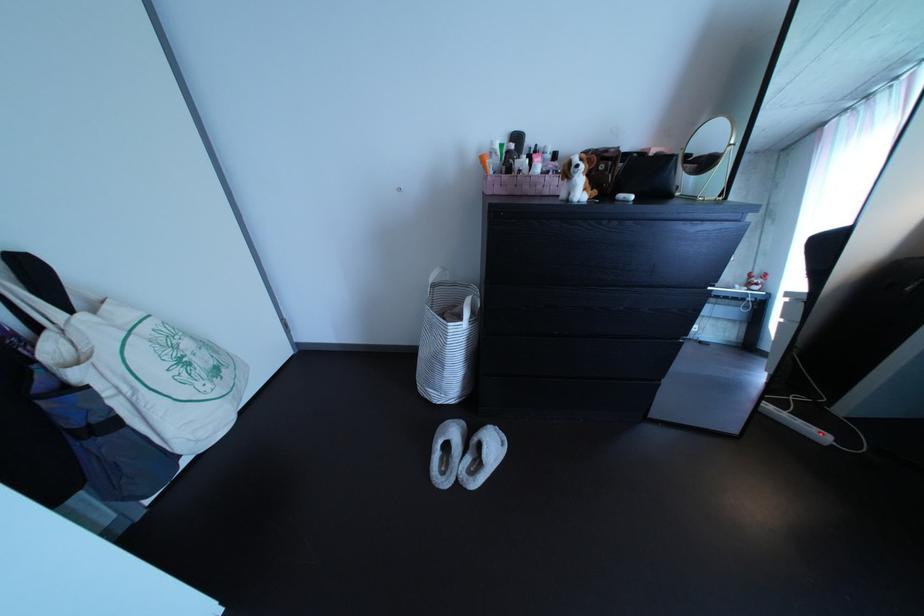
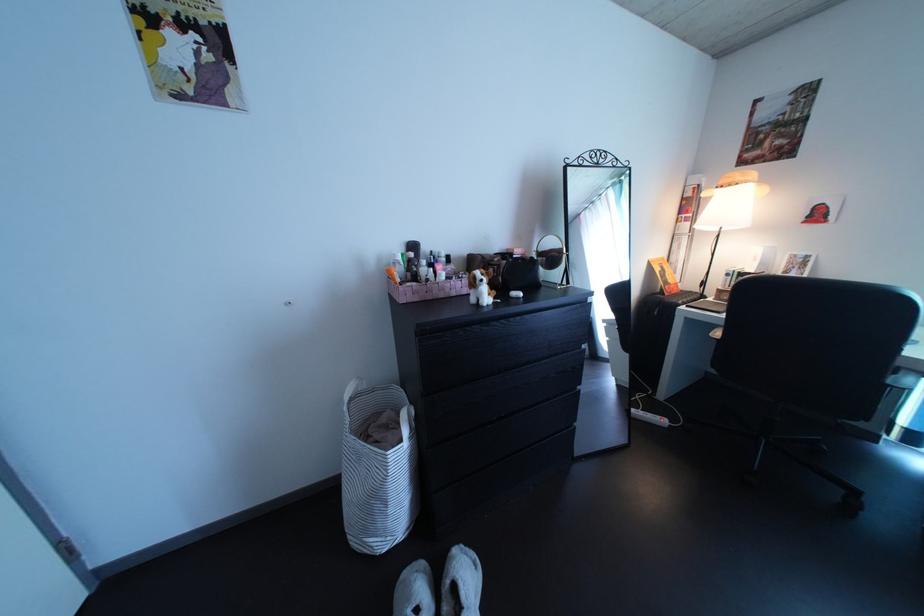
Where in the second image is the point corresponding to pixel 584 171 from the first image?

(489, 286)